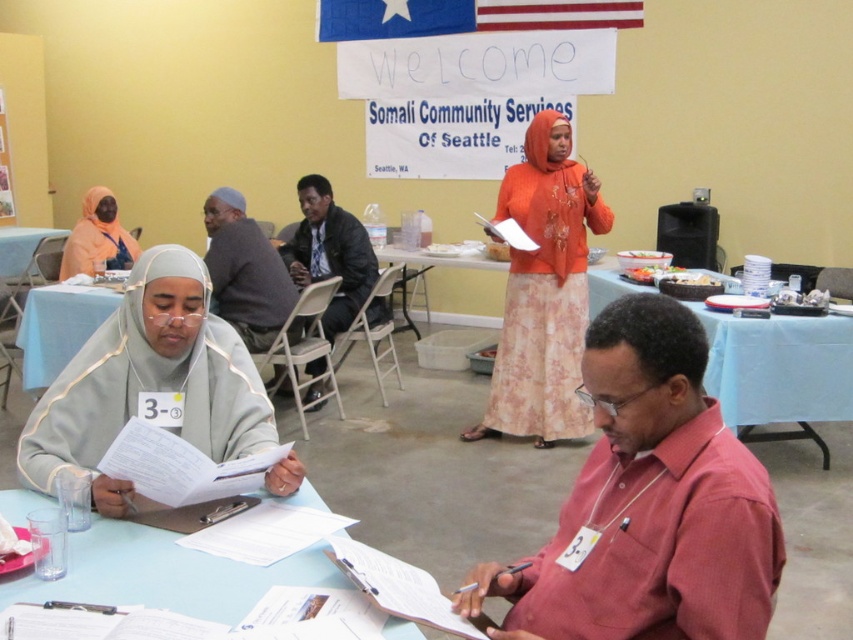
Based on the photo, you are at the Somali Community Services of Seattle event and want to find the dark gray sweater at center. Based on the coordinates provided, can you confirm if the point at (245,272) is the correct location for the dark gray sweater at center?

Yes, the point at (245,272) corresponds to the dark gray sweater at center, so that is the correct location.

You are standing at the entrance of the community center and see two points marked in the scene. Which point is closer to you, point (212,234) or point (30,353)?

Point (30,353) is closer to you because it is in front of point (212,234).

You are organizing a community event and need to place a new sign on the table. Given the objects present, will the sign fit on the blue fabric table at lower left without overlapping the dark gray sweater at center?

The dark gray sweater at center occupies less space than the blue fabric table at lower left, so there should be enough space to place the sign on the blue fabric table at lower left without overlapping the sweater.